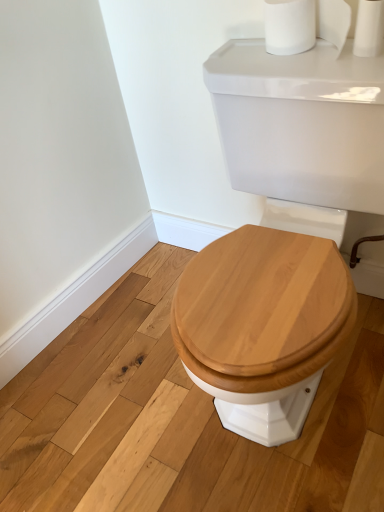
Question: Considering the relative positions of white matte toilet paper at upper right and white glossy porcelain at center in the image provided, is white matte toilet paper at upper right to the left or to the right of white glossy porcelain at center?

Choices:
 (A) left
 (B) right

Answer: (B)

Question: From the image's perspective, relative to white glossy porcelain at center, is white matte toilet paper at upper right above or below?

Choices:
 (A) above
 (B) below

Answer: (A)

Question: From a real-world perspective, is white matte toilet paper at upper right physically located above or below white glossy porcelain at center?

Choices:
 (A) above
 (B) below

Answer: (A)

Question: Considering the positions of white glossy porcelain at center and white matte toilet paper at upper right in the image, is white glossy porcelain at center taller or shorter than white matte toilet paper at upper right?

Choices:
 (A) short
 (B) tall

Answer: (B)

Question: Is white glossy porcelain at center spatially inside white matte toilet paper at upper right, or outside of it?

Choices:
 (A) inside
 (B) outside

Answer: (B)

Question: Relative to white matte toilet paper at upper right, is white glossy porcelain at center in front or behind?

Choices:
 (A) front
 (B) behind

Answer: (A)

Question: From the image's perspective, is white glossy porcelain at center positioned above or below white matte toilet paper at upper right?

Choices:
 (A) above
 (B) below

Answer: (B)